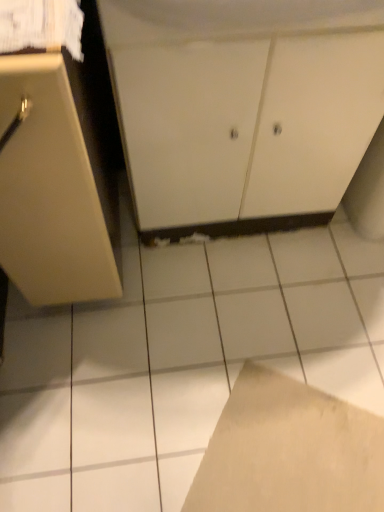
Describe the element at coordinates (60, 175) in the screenshot. I see `matte beige cabinet at left, marked as the first cabinetry in a left-to-right arrangement` at that location.

Where is `white glossy tile at center`? The height and width of the screenshot is (512, 384). white glossy tile at center is located at coordinates (179, 361).

Locate an element on the screen. white matte cabinet at center, which is counted as the second cabinetry, starting from the left is located at coordinates (243, 106).

How distant is brown cardboard at lower center from white matte cabinet at center, which is counted as the second cabinetry, starting from the left?

brown cardboard at lower center is 25.57 inches away from white matte cabinet at center, which is counted as the second cabinetry, starting from the left.

Is brown cardboard at lower center not inside white matte cabinet at center, positioned as the 1th cabinetry in right-to-left order?

brown cardboard at lower center lies outside white matte cabinet at center, positioned as the 1th cabinetry in right-to-left order,'s area.

What's the angular difference between brown cardboard at lower center and white matte cabinet at center, which is counted as the second cabinetry, starting from the left,'s facing directions?

57.9 degrees separate the facing orientations of brown cardboard at lower center and white matte cabinet at center, which is counted as the second cabinetry, starting from the left.

Considering the positions of objects brown cardboard at lower center and white matte cabinet at center, positioned as the 1th cabinetry in right-to-left order, in the image provided, who is behind, brown cardboard at lower center or white matte cabinet at center, positioned as the 1th cabinetry in right-to-left order,?

brown cardboard at lower center.

From the image's perspective, between white glossy tile at center and white matte cabinet at center, which is counted as the second cabinetry, starting from the left, who is located below?

white glossy tile at center appears lower in the image.

Could you tell me if white glossy tile at center is facing white matte cabinet at center, which is counted as the second cabinetry, starting from the left?

No, white glossy tile at center is not facing towards white matte cabinet at center, which is counted as the second cabinetry, starting from the left.

Is white glossy tile at center to the left or to the right of white matte cabinet at center, positioned as the 1th cabinetry in right-to-left order, in the image?

In the image, white glossy tile at center appears on the left side of white matte cabinet at center, positioned as the 1th cabinetry in right-to-left order.

Between point (244, 411) and point (81, 238), which one is positioned in front?

The point (81, 238) is closer to the camera.

From the image's perspective, is brown cardboard at lower center below matte beige cabinet at left, which is counted as the 2th cabinetry, starting from the right?

Yes, from the image's perspective, brown cardboard at lower center is beneath matte beige cabinet at left, which is counted as the 2th cabinetry, starting from the right.

Is brown cardboard at lower center turned away from matte beige cabinet at left, which is counted as the 2th cabinetry, starting from the right?

brown cardboard at lower center is not turned away from matte beige cabinet at left, which is counted as the 2th cabinetry, starting from the right.

In the scene shown: Which object is thinner, brown cardboard at lower center or matte beige cabinet at left, marked as the first cabinetry in a left-to-right arrangement?

With smaller width is brown cardboard at lower center.

Which of these two, matte beige cabinet at left, which is counted as the 2th cabinetry, starting from the right, or brown cardboard at lower center, stands shorter?

Standing shorter between the two is brown cardboard at lower center.

Is matte beige cabinet at left, which is counted as the 2th cabinetry, starting from the right, looking in the opposite direction of brown cardboard at lower center?

matte beige cabinet at left, which is counted as the 2th cabinetry, starting from the right, does not have its back to brown cardboard at lower center.

Are matte beige cabinet at left, marked as the first cabinetry in a left-to-right arrangement, and brown cardboard at lower center beside each other?

No, matte beige cabinet at left, marked as the first cabinetry in a left-to-right arrangement, is not in contact with brown cardboard at lower center.

Which object is positioned more to the right, matte beige cabinet at left, marked as the first cabinetry in a left-to-right arrangement, or brown cardboard at lower center?

brown cardboard at lower center.

How much distance is there between white matte cabinet at center, positioned as the 1th cabinetry in right-to-left order, and white glossy tile at center?

white matte cabinet at center, positioned as the 1th cabinetry in right-to-left order, and white glossy tile at center are 16.63 inches apart.

From the picture: Is there a large distance between white matte cabinet at center, positioned as the 1th cabinetry in right-to-left order, and white glossy tile at center?

That's not correct — white matte cabinet at center, positioned as the 1th cabinetry in right-to-left order, is a little close to white glossy tile at center.

From the image's perspective, is white matte cabinet at center, which is counted as the second cabinetry, starting from the left, located above or below white glossy tile at center?

From the image's perspective, white matte cabinet at center, which is counted as the second cabinetry, starting from the left, appears above white glossy tile at center.

In terms of height, does white matte cabinet at center, which is counted as the second cabinetry, starting from the left, look taller or shorter compared to white glossy tile at center?

Clearly, white matte cabinet at center, which is counted as the second cabinetry, starting from the left, is taller compared to white glossy tile at center.

Is white matte cabinet at center, positioned as the 1th cabinetry in right-to-left order, positioned behind matte beige cabinet at left, which is counted as the 2th cabinetry, starting from the right?

Yes, it is behind matte beige cabinet at left, which is counted as the 2th cabinetry, starting from the right.

From a real-world perspective, is white matte cabinet at center, which is counted as the second cabinetry, starting from the left, above or below matte beige cabinet at left, marked as the first cabinetry in a left-to-right arrangement?

In terms of real-world spatial position, white matte cabinet at center, which is counted as the second cabinetry, starting from the left, is below matte beige cabinet at left, marked as the first cabinetry in a left-to-right arrangement.

Is matte beige cabinet at left, which is counted as the 2th cabinetry, starting from the right, completely or partially inside white matte cabinet at center, which is counted as the second cabinetry, starting from the left?

Actually, matte beige cabinet at left, which is counted as the 2th cabinetry, starting from the right, is outside white matte cabinet at center, which is counted as the second cabinetry, starting from the left.

Find the location of a particular element. cabinetry in front of the white matte cabinet at center, which is counted as the second cabinetry, starting from the left is located at coordinates (60, 175).

From a real-world perspective, which is physically above, white matte cabinet at center, which is counted as the second cabinetry, starting from the left, or brown cardboard at lower center?

In real-world perspective, white matte cabinet at center, which is counted as the second cabinetry, starting from the left, is above.

Is point (136, 26) in front of point (243, 367)?

Yes, it is in front of point (243, 367).

Relative to brown cardboard at lower center, is white matte cabinet at center, which is counted as the second cabinetry, starting from the left, in front or behind?

In the image, white matte cabinet at center, which is counted as the second cabinetry, starting from the left, appears in front of brown cardboard at lower center.

Visually, is white matte cabinet at center, positioned as the 1th cabinetry in right-to-left order, positioned to the left or to the right of brown cardboard at lower center?

From the image, it's evident that white matte cabinet at center, positioned as the 1th cabinetry in right-to-left order, is to the left of brown cardboard at lower center.

At what (x,y) coordinates should I click in order to perform the action: click on cabinetry that is the 1st object above the brown cardboard at lower center (from a real-world perspective). Please return your answer as a coordinate pair (x, y). This screenshot has width=384, height=512. Looking at the image, I should click on (243, 106).

Identify the location of ceramic tile below the white matte cabinet at center, which is counted as the second cabinetry, starting from the left (from a real-world perspective). The image size is (384, 512). (179, 361).

Considering their positions, is brown cardboard at lower center positioned closer to matte beige cabinet at left, marked as the first cabinetry in a left-to-right arrangement, than white glossy tile at center?

white glossy tile at center lies closer to matte beige cabinet at left, marked as the first cabinetry in a left-to-right arrangement, than the other object.

Estimate the real-world distances between objects in this image. Which object is closer to matte beige cabinet at left, which is counted as the 2th cabinetry, starting from the right, white glossy tile at center or white matte cabinet at center, which is counted as the second cabinetry, starting from the left?

white matte cabinet at center, which is counted as the second cabinetry, starting from the left, lies closer to matte beige cabinet at left, which is counted as the 2th cabinetry, starting from the right, than the other object.

Estimate the real-world distances between objects in this image. Which object is closer to white glossy tile at center, white matte cabinet at center, positioned as the 1th cabinetry in right-to-left order, or brown cardboard at lower center?

The object closer to white glossy tile at center is brown cardboard at lower center.

Based on their spatial positions, is white glossy tile at center or matte beige cabinet at left, which is counted as the 2th cabinetry, starting from the right, further from brown cardboard at lower center?

matte beige cabinet at left, which is counted as the 2th cabinetry, starting from the right.

Which object lies nearer to the anchor point brown cardboard at lower center, white glossy tile at center or white matte cabinet at center, which is counted as the second cabinetry, starting from the left?

The object closer to brown cardboard at lower center is white glossy tile at center.

Estimate the real-world distances between objects in this image. Which object is further from white matte cabinet at center, which is counted as the second cabinetry, starting from the left, white glossy tile at center or brown cardboard at lower center?

Among the two, brown cardboard at lower center is located further to white matte cabinet at center, which is counted as the second cabinetry, starting from the left.

From the image, which object appears to be farther from brown cardboard at lower center, white matte cabinet at center, which is counted as the second cabinetry, starting from the left, or matte beige cabinet at left, which is counted as the 2th cabinetry, starting from the right?

Based on the image, white matte cabinet at center, which is counted as the second cabinetry, starting from the left, appears to be further to brown cardboard at lower center.

Based on the photo, based on their spatial positions, is brown cardboard at lower center or matte beige cabinet at left, marked as the first cabinetry in a left-to-right arrangement, further from white glossy tile at center?

matte beige cabinet at left, marked as the first cabinetry in a left-to-right arrangement, is positioned further to the anchor white glossy tile at center.

Where is `cabinetry between white matte cabinet at center, which is counted as the second cabinetry, starting from the left, and brown cardboard at lower center, in the vertical direction`? This screenshot has height=512, width=384. cabinetry between white matte cabinet at center, which is counted as the second cabinetry, starting from the left, and brown cardboard at lower center, in the vertical direction is located at coordinates (60, 175).

In order to click on ceramic tile between matte beige cabinet at left, which is counted as the 2th cabinetry, starting from the right, and brown cardboard at lower center vertically in this screenshot , I will do `click(179, 361)`.

At what (x,y) coordinates should I click in order to perform the action: click on ceramic tile between white matte cabinet at center, positioned as the 1th cabinetry in right-to-left order, and brown cardboard at lower center from top to bottom. Please return your answer as a coordinate pair (x, y). This screenshot has height=512, width=384. Looking at the image, I should click on (179, 361).

The height and width of the screenshot is (512, 384). I want to click on cabinetry between white matte cabinet at center, which is counted as the second cabinetry, starting from the left, and white glossy tile at center, in the vertical direction, so click(60, 175).